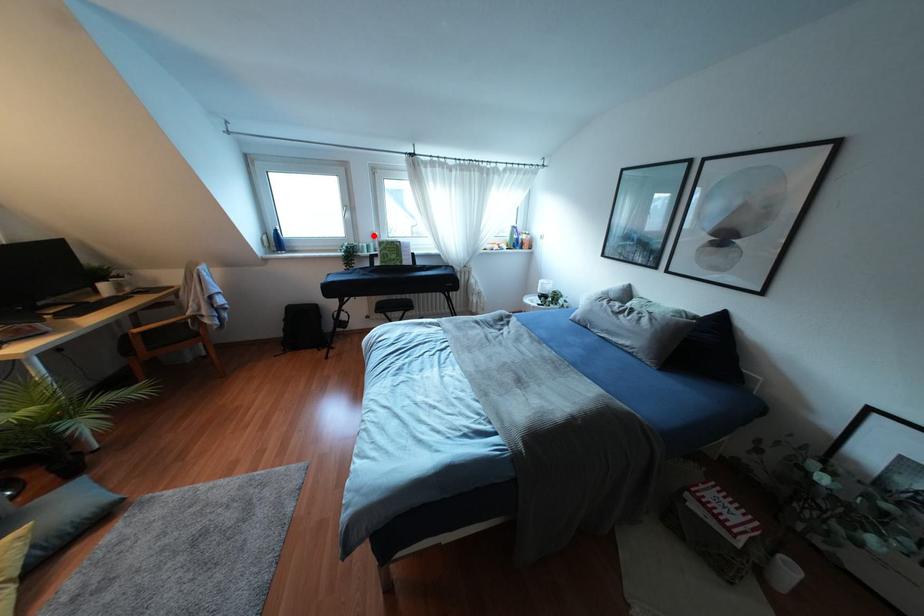
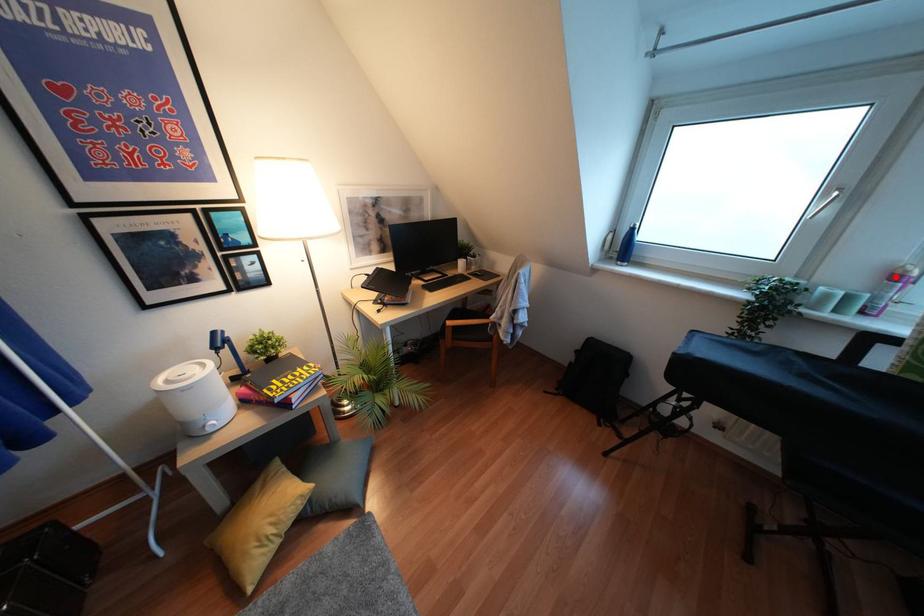
I am providing you with two images of the same scene from different viewpoints. A red point is marked on the first image and another point is marked on the second image. Are the points marked in image1 and image2 representing the same 3D position?

Yes